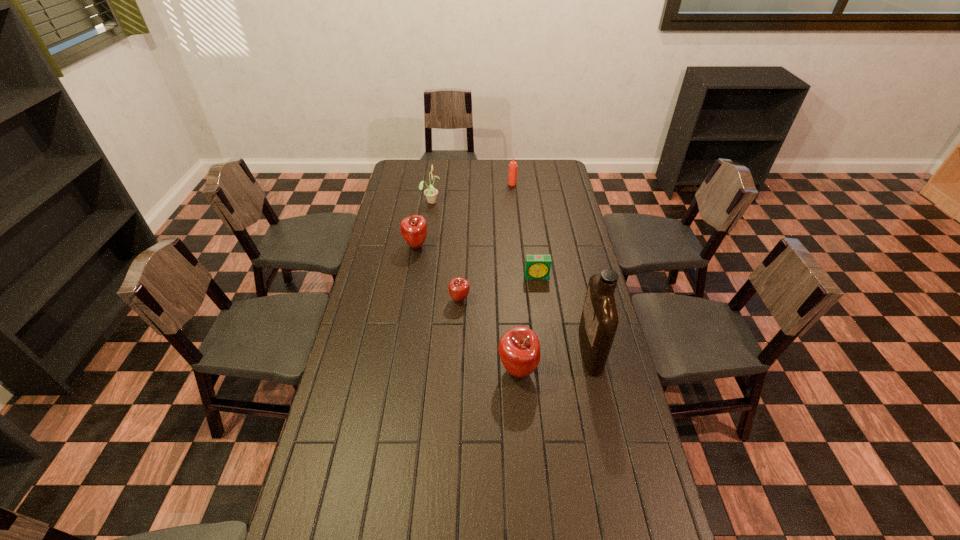
The image size is (960, 540). Identify the location of free space located 0.090m on the right of the second tallest apple. (449, 246).

This screenshot has width=960, height=540. I want to click on free location located on the front of the second apple from left to right, so point(457,350).

You are a GUI agent. You are given a task and a screenshot of the screen. Output one action in this format:
    pyautogui.click(x=<x>, y=<y>)
    Task: Click on the free space located on the left of the nearest apple
    This screenshot has height=540, width=960.
    Given the screenshot: What is the action you would take?
    pyautogui.click(x=405, y=370)

Where is `free space located on the front-facing side of the sunflower`? free space located on the front-facing side of the sunflower is located at coordinates (464, 201).

At what (x,y) coordinates should I click in order to perform the action: click on blank area located on the back of the farthest object. Please return your answer as a coordinate pair (x, y). Image resolution: width=960 pixels, height=540 pixels. Looking at the image, I should click on (511, 172).

I want to click on vacant space located 0.330m on the front-facing side of the alarm clock, so click(x=547, y=347).

Where is `blank area located 0.180m on the label side of the rightmost object`? blank area located 0.180m on the label side of the rightmost object is located at coordinates (527, 350).

I want to click on free space located 0.210m on the label side of the rightmost object, so click(518, 350).

Locate an element on the screen. The image size is (960, 540). free space located on the label side of the rightmost object is located at coordinates (497, 350).

Identify the location of object located at the far edge. The width and height of the screenshot is (960, 540). (512, 176).